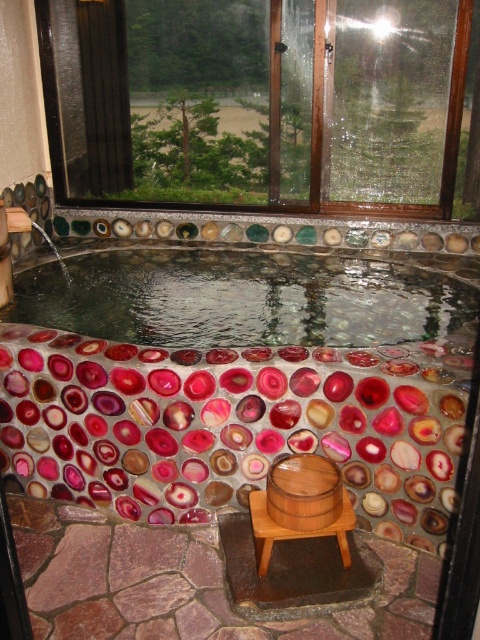
Question: Which point is farther from the camera taking this photo?

Choices:
 (A) (316, 502)
 (B) (220, 449)

Answer: (B)

Question: Can you confirm if transparent glass window at upper center is thinner than wooden barrel at center?

Choices:
 (A) yes
 (B) no

Answer: (B)

Question: Is the position of transparent glass window at upper center less distant than that of wooden at lower center?

Choices:
 (A) yes
 (B) no

Answer: (B)

Question: Which of these objects is positioned farthest from the polished stone bath at center?

Choices:
 (A) wooden at lower center
 (B) transparent glass window at upper center

Answer: (B)

Question: Is polished stone bath at center bigger than transparent glass window at upper center?

Choices:
 (A) no
 (B) yes

Answer: (B)

Question: Which object appears closest to the camera in this image?

Choices:
 (A) wooden barrel at center
 (B) transparent glass window at upper center

Answer: (A)